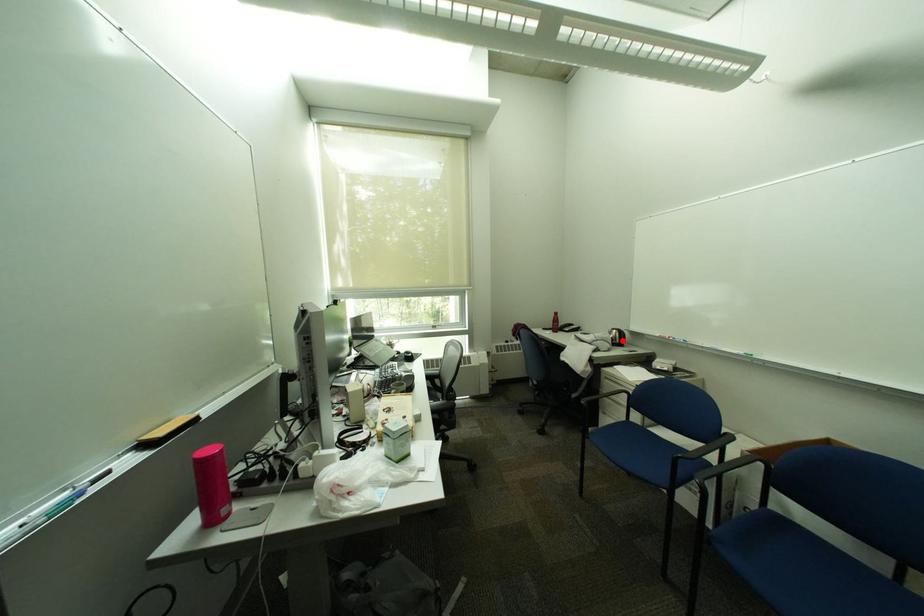
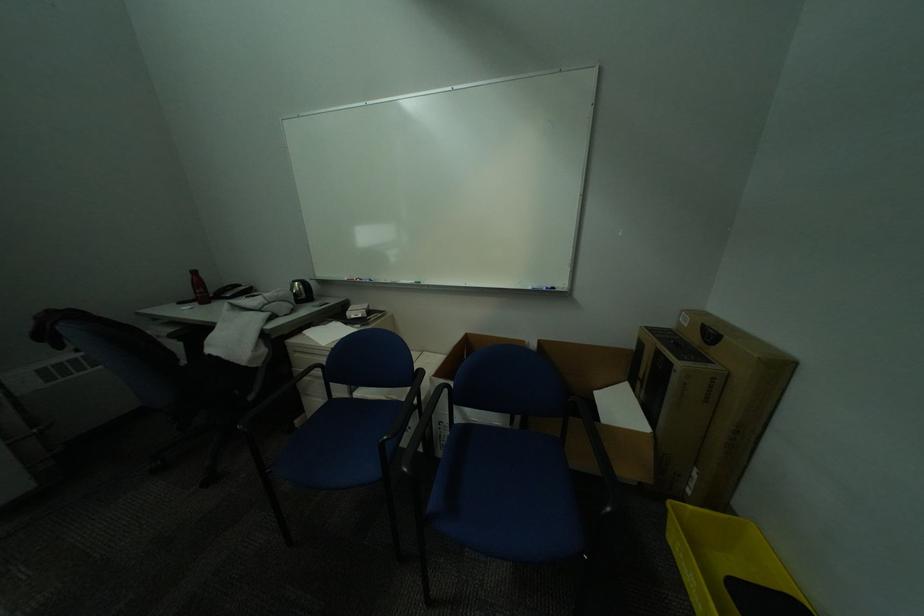
Question: A red point is marked in image1. In image2, is the corresponding 3D point closer to the camera or farther? Reply with the corresponding letter.

Choices:
 (A) The corresponding 3D point is closer.
 (B) The corresponding 3D point is farther.

Answer: (A)